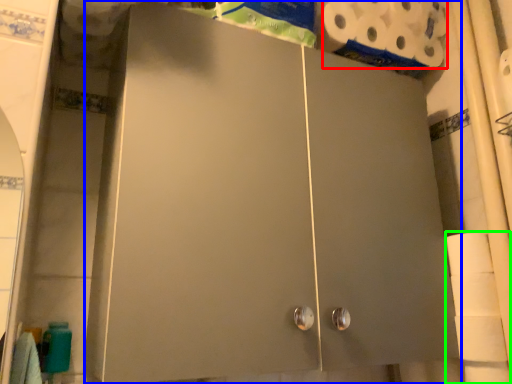
Question: Considering the real-world distances, which object is farthest from toilet paper (highlighted by a red box)? cupboard (highlighted by a blue box) or toilet paper (highlighted by a green box)?

Choices:
 (A) cupboard
 (B) toilet paper

Answer: (B)